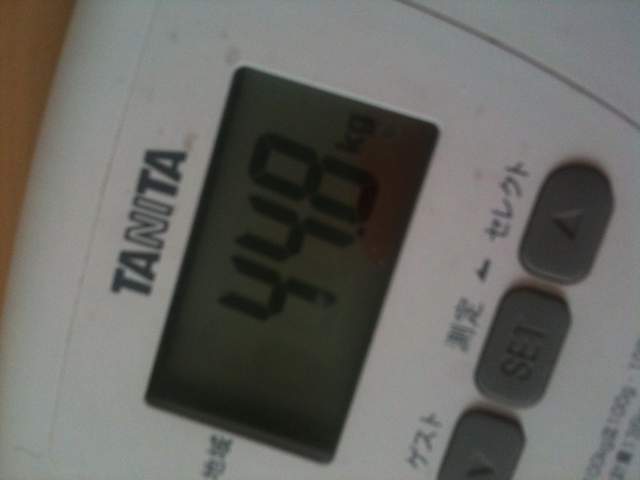
You are a GUI agent. You are given a task and a screenshot of the screen. Output one action in this format:
    pyautogui.click(x=<x>, y=<y>)
    Task: Click on the rounded rectangular shape grey rubber press button - top
    The height and width of the screenshot is (480, 640).
    Given the screenshot: What is the action you would take?
    pyautogui.click(x=582, y=180)